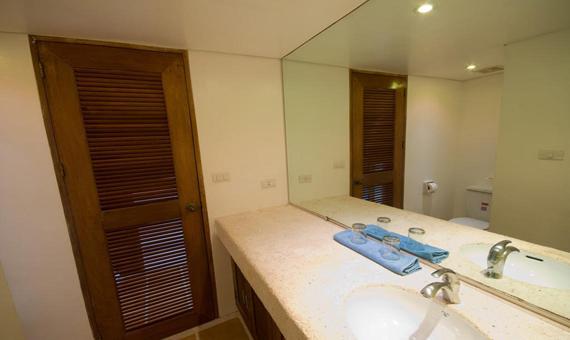
This screenshot has height=340, width=570. What are the coordinates of `wide wall width mirror` in the screenshot? It's located at (402, 138).